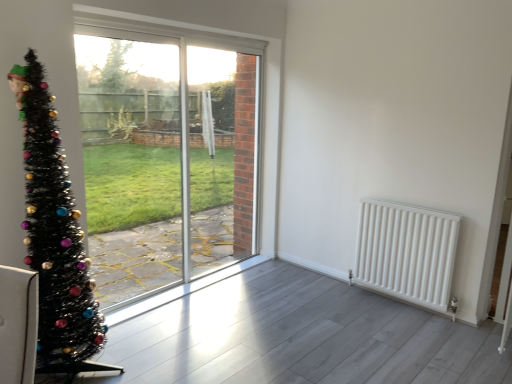
Question: Is black tinsel christmas tree at left oriented towards clear glass screen door at center?

Choices:
 (A) no
 (B) yes

Answer: (A)

Question: From a real-world perspective, is black tinsel christmas tree at left below clear glass screen door at center?

Choices:
 (A) no
 (B) yes

Answer: (B)

Question: Does black tinsel christmas tree at left have a greater height compared to clear glass screen door at center?

Choices:
 (A) yes
 (B) no

Answer: (B)

Question: Does black tinsel christmas tree at left lie behind clear glass screen door at center?

Choices:
 (A) yes
 (B) no

Answer: (B)

Question: Is black tinsel christmas tree at left wider than clear glass screen door at center?

Choices:
 (A) no
 (B) yes

Answer: (B)

Question: Considering the relative positions of black tinsel christmas tree at left and clear glass screen door at center in the image provided, is black tinsel christmas tree at left to the left of clear glass screen door at center from the viewer's perspective?

Choices:
 (A) no
 (B) yes

Answer: (B)

Question: From the image's perspective, does black tinsel christmas tree at left appear lower than transparent glass window at center?

Choices:
 (A) yes
 (B) no

Answer: (A)

Question: Are black tinsel christmas tree at left and transparent glass window at center beside each other?

Choices:
 (A) no
 (B) yes

Answer: (A)

Question: Can you confirm if black tinsel christmas tree at left is shorter than transparent glass window at center?

Choices:
 (A) no
 (B) yes

Answer: (B)

Question: Is black tinsel christmas tree at left closer to the viewer compared to transparent glass window at center?

Choices:
 (A) no
 (B) yes

Answer: (B)

Question: Considering the relative sizes of black tinsel christmas tree at left and transparent glass window at center in the image provided, is black tinsel christmas tree at left smaller than transparent glass window at center?

Choices:
 (A) no
 (B) yes

Answer: (A)

Question: Can you confirm if black tinsel christmas tree at left is bigger than transparent glass window at center?

Choices:
 (A) no
 (B) yes

Answer: (B)

Question: Is white matte radiator at right positioned before transparent glass window at center?

Choices:
 (A) no
 (B) yes

Answer: (A)